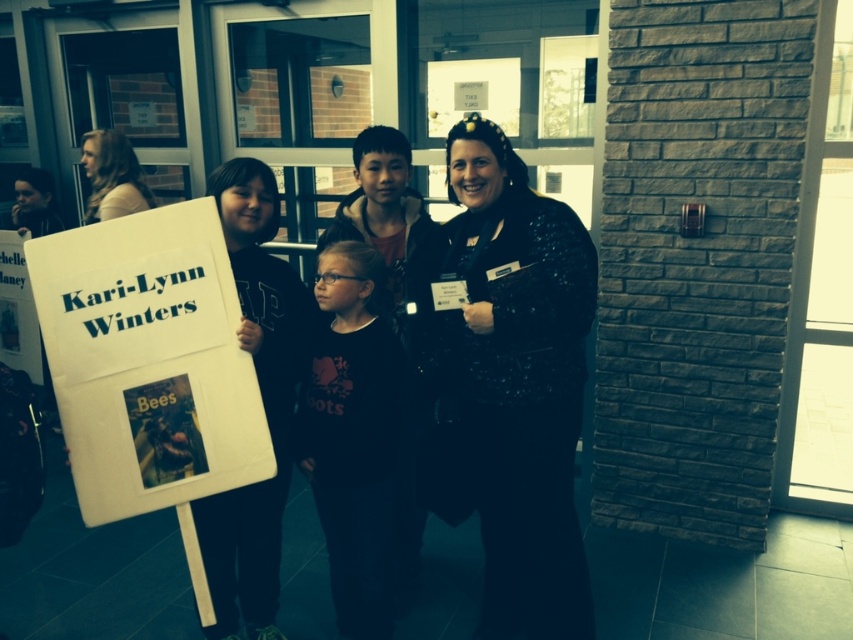
Who is positioned more to the right, black sequined sweater at center or matte black jacket at center?

From the viewer's perspective, black sequined sweater at center appears more on the right side.

From the picture: Is black sequined sweater at center taller than matte black jacket at center?

Correct, black sequined sweater at center is much taller as matte black jacket at center.

Find the location of a particular element. This screenshot has height=640, width=853. black sequined sweater at center is located at coordinates (509, 385).

Can you confirm if matte black jacket at center is positioned above white paper at center?

Incorrect, matte black jacket at center is not positioned above white paper at center.

Based on the photo, can you confirm if matte black jacket at center is positioned to the right of white paper at center?

Indeed, matte black jacket at center is positioned on the right side of white paper at center.

Does point (280, 333) come closer to viewer compared to point (35, 381)?

Yes, point (280, 333) is in front of point (35, 381).

In order to click on matte black jacket at center in this screenshot , I will do `click(262, 403)`.

Can you confirm if black sequined sweater at center is thinner than white paper at center?

Incorrect, black sequined sweater at center's width is not less than white paper at center's.

Who is more forward, (573, 570) or (3, 228)?

Positioned in front is point (573, 570).

Which is behind, point (548, 387) or point (28, 312)?

The point (28, 312) is behind.

Locate an element on the screen. black sequined sweater at center is located at coordinates (509, 385).